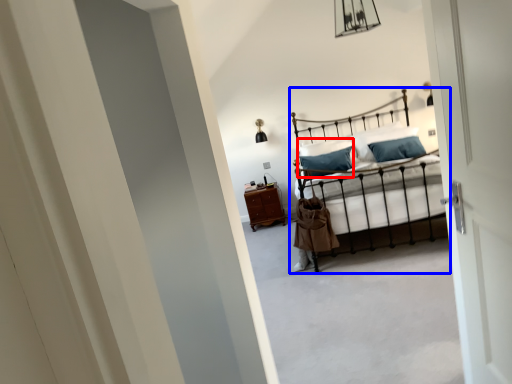
Question: Among these objects, which one is nearest to the camera, pillow (highlighted by a red box) or bed (highlighted by a blue box)?

Choices:
 (A) pillow
 (B) bed

Answer: (B)